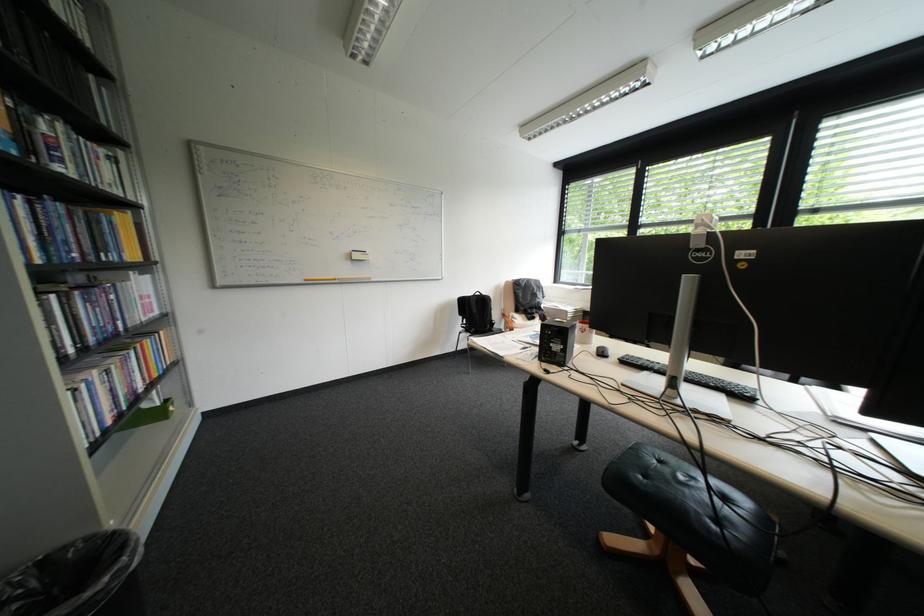
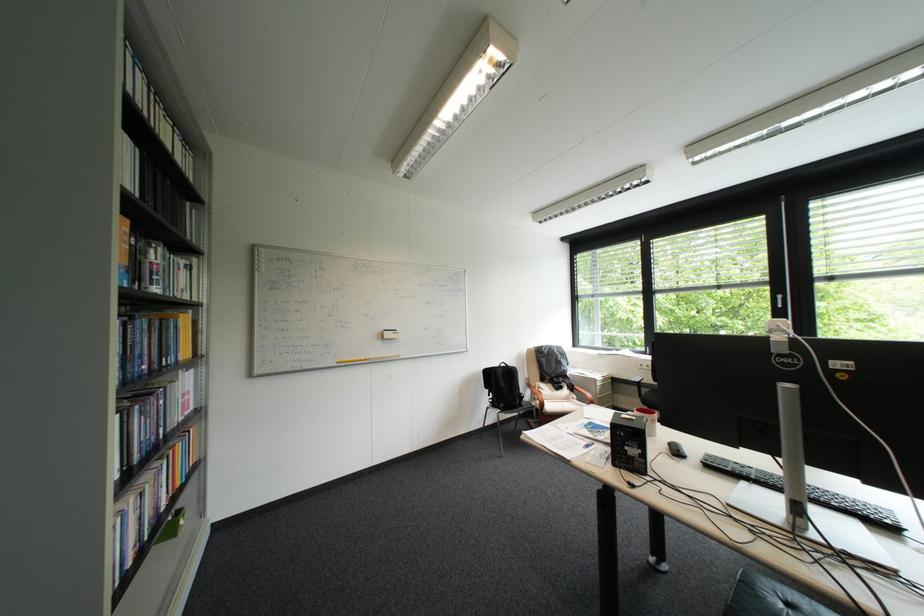
Find the pixel in the second image that matches [591,323] in the first image.

(650, 411)